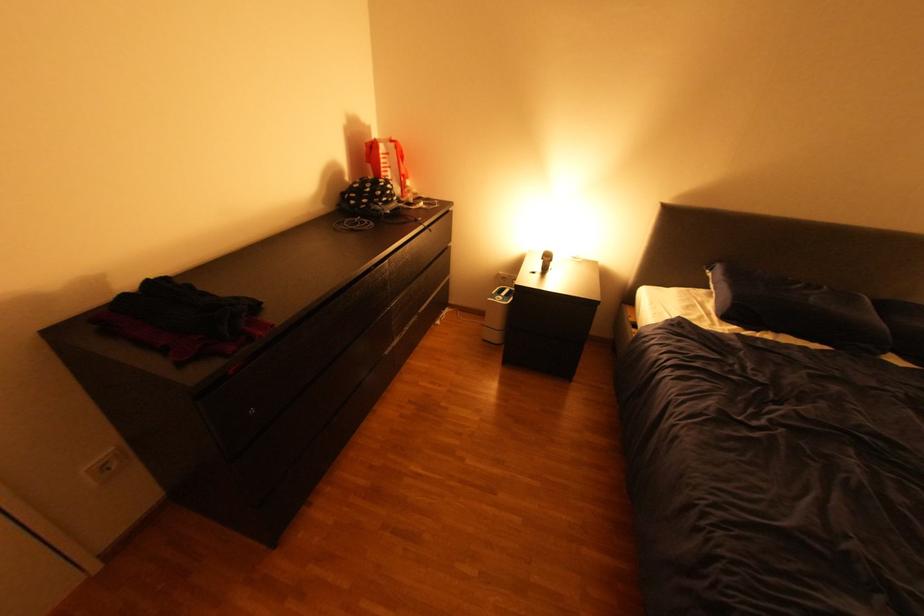
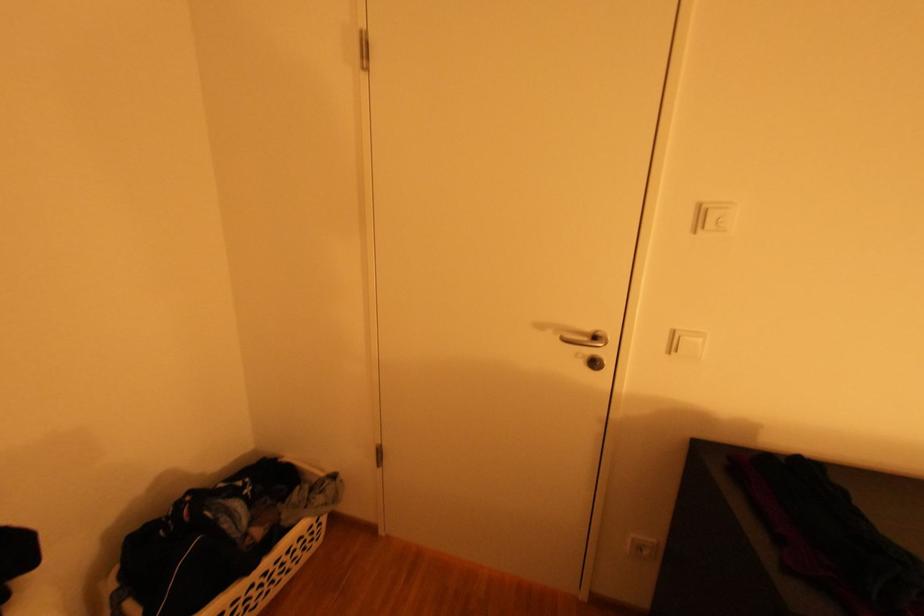
Question: The camera is either moving clockwise (left) or counter-clockwise (right) around the object. The first image is from the beginning of the video and the second image is from the end. Is the camera moving left or right when shooting the video?

Choices:
 (A) Left
 (B) Right

Answer: (B)